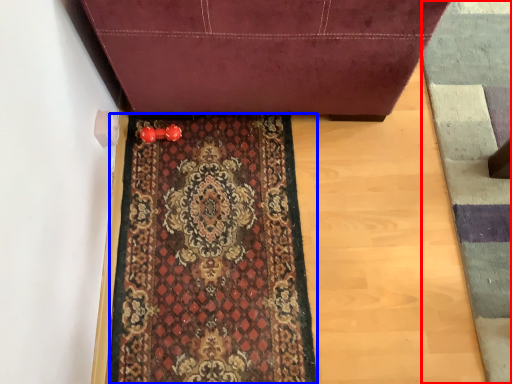
Question: Which point is closer to the camera, doormat (highlighted by a red box) or mat (highlighted by a blue box)?

Choices:
 (A) doormat
 (B) mat

Answer: (A)